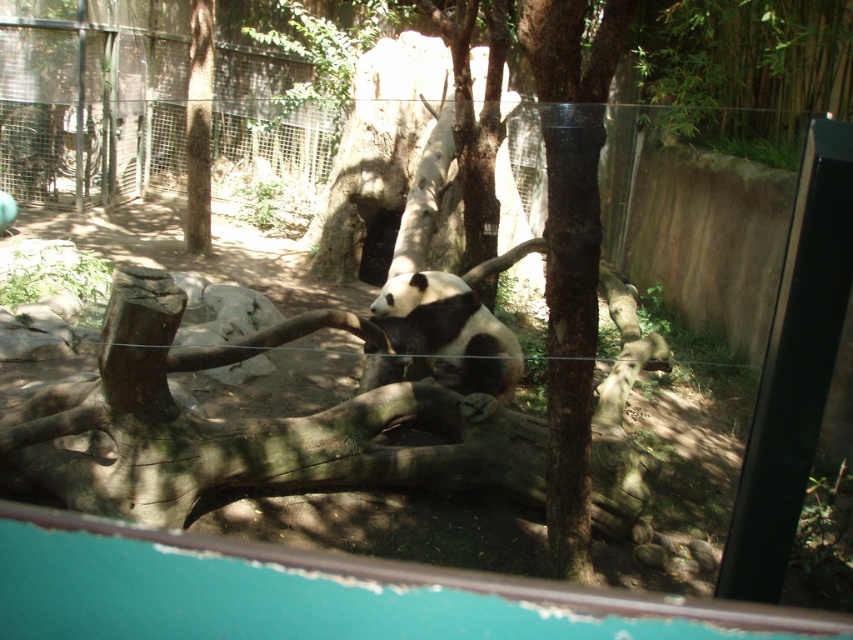
Question: Does black and white fur at center appear on the left side of brown rough tree trunk at upper left?

Choices:
 (A) no
 (B) yes

Answer: (A)

Question: Is black and white fur at center in front of brown rough tree trunk at upper left?

Choices:
 (A) no
 (B) yes

Answer: (B)

Question: Which point is farther to the camera?

Choices:
 (A) (384, 365)
 (B) (207, 170)

Answer: (B)

Question: Is black and white fur at center smaller than brown rough tree trunk at upper left?

Choices:
 (A) yes
 (B) no

Answer: (A)